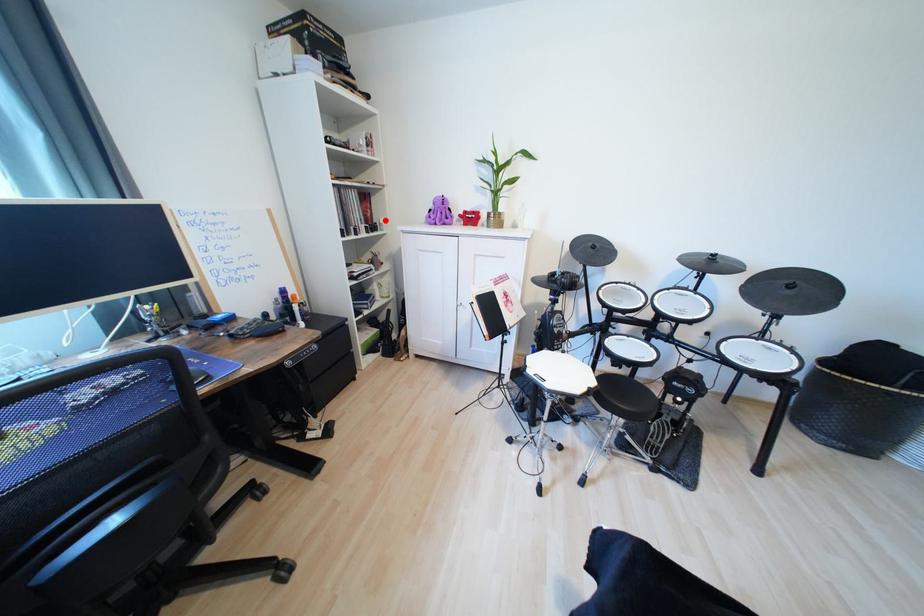
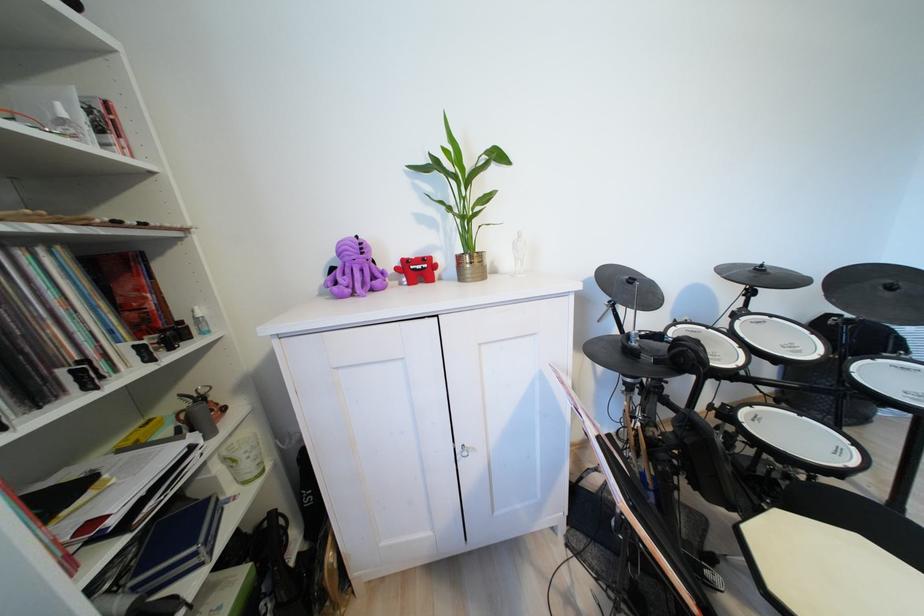
In the second image, find the point that corresponds to the highlighted location in the first image.

(196, 310)